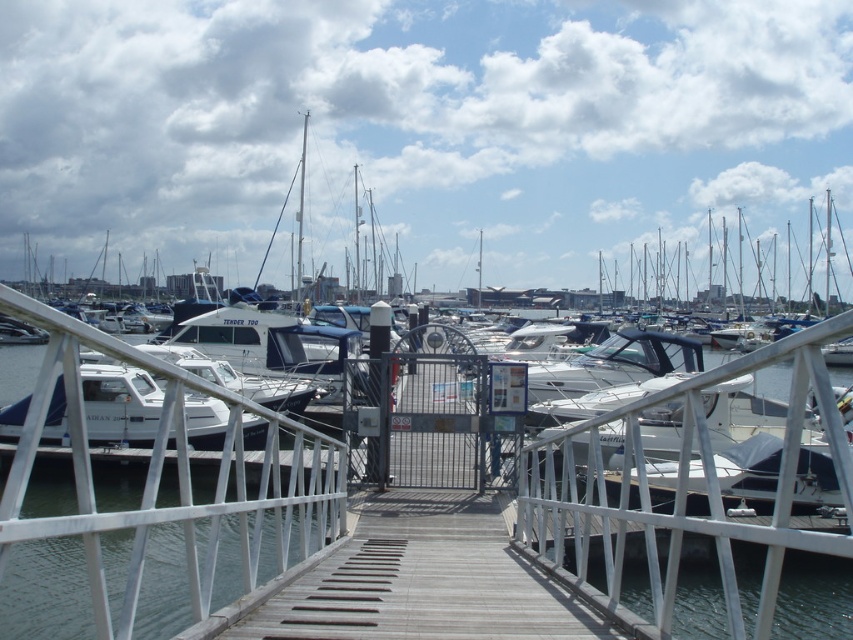
You are standing on the wooden walkway and want to take a photo of the white matte boat at center. Which direction should you turn to face the clear water at center first before aiming at the boat?

The clear water at center is to the left of the white matte boat at center, so you should turn to your left to face the clear water first before aiming at the boat.